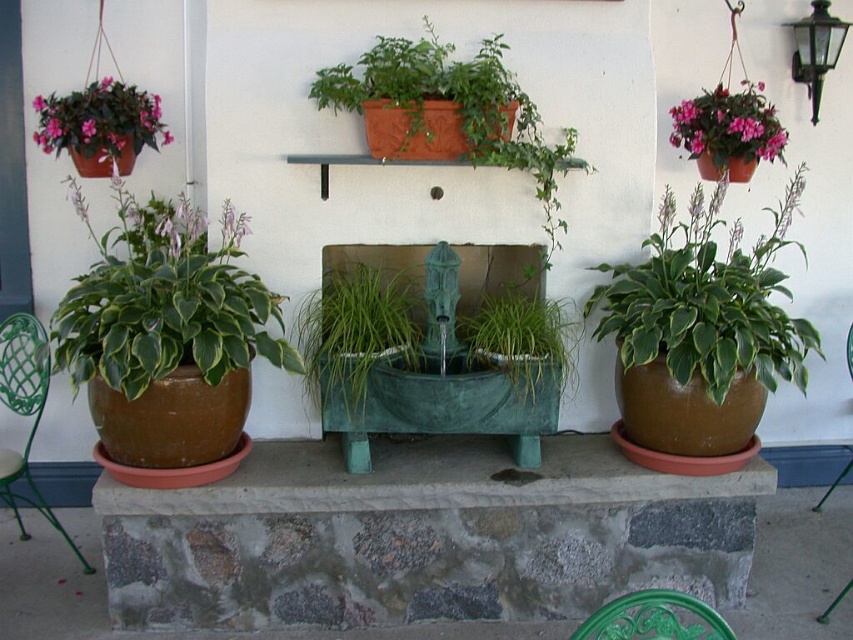
Question: Can you confirm if pink matte flower pot at upper left is bigger than green metal chair at lower left?

Choices:
 (A) yes
 (B) no

Answer: (B)

Question: Which object is closer to the camera taking this photo?

Choices:
 (A) black glass lamp at upper right
 (B) matte pink flowers at upper right

Answer: (B)

Question: Considering the relative positions of green matte pot at left and green metal chair at lower left in the image provided, where is green matte pot at left located with respect to green metal chair at lower left?

Choices:
 (A) above
 (B) below

Answer: (A)

Question: Which point is farther from the camera taking this photo?

Choices:
 (A) (705, 604)
 (B) (347, 282)

Answer: (B)

Question: Considering the real-world distances, which object is closest to the pink matte flower pot at upper left?

Choices:
 (A) black glass lamp at upper right
 (B) green matte pot at left
 (C) green metal chair at lower center
 (D) green metal chair at lower left

Answer: (B)

Question: Is pink matte flower pot at upper left above matte pink flowers at upper right?

Choices:
 (A) no
 (B) yes

Answer: (A)